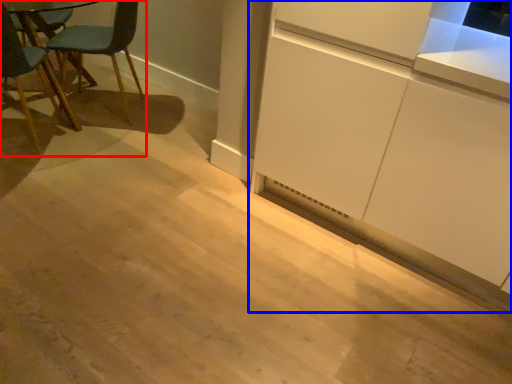
Question: Which object appears closest to the camera in this image, chair (highlighted by a red box) or cabinetry (highlighted by a blue box)?

Choices:
 (A) chair
 (B) cabinetry

Answer: (B)